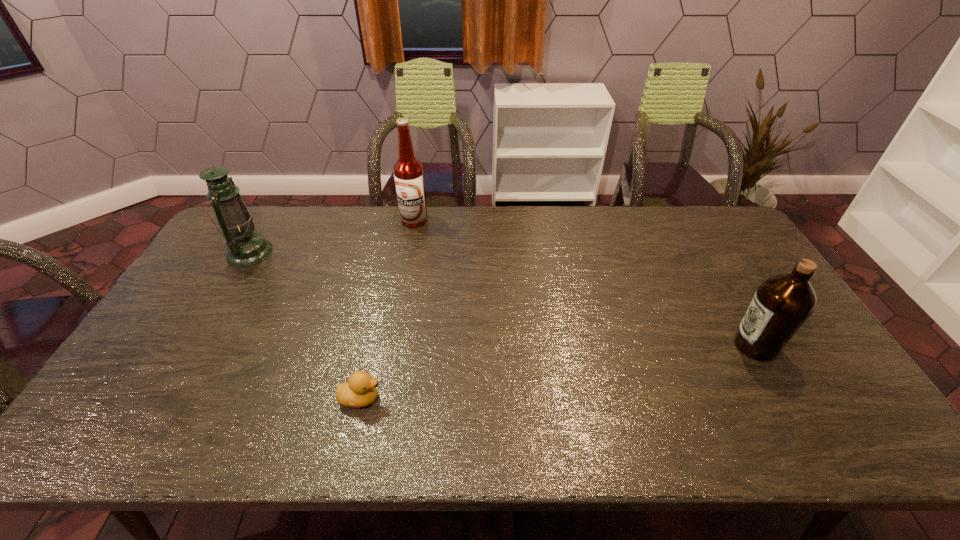
Find the location of a particular element. The height and width of the screenshot is (540, 960). vacant area located on the label of the rightmost object is located at coordinates (588, 345).

Where is `blank area located on the label of the rightmost object`? This screenshot has width=960, height=540. blank area located on the label of the rightmost object is located at coordinates (677, 345).

This screenshot has width=960, height=540. Find the location of `vacant space located facing forward on the nearest object`. vacant space located facing forward on the nearest object is located at coordinates (486, 398).

In order to click on alcohol located at the far edge in this screenshot , I will do `click(408, 171)`.

You are a GUI agent. You are given a task and a screenshot of the screen. Output one action in this format:
    pyautogui.click(x=<x>, y=<y>)
    Task: Click on the oil lamp at the far edge
    The image size is (960, 540).
    Given the screenshot: What is the action you would take?
    pyautogui.click(x=245, y=248)

Image resolution: width=960 pixels, height=540 pixels. What are the coordinates of `object at the left edge` in the screenshot? It's located at (245, 248).

Locate an element on the screen. The width and height of the screenshot is (960, 540). object positioned at the right edge is located at coordinates (782, 303).

Where is `object at the far left corner`? object at the far left corner is located at coordinates (245, 248).

This screenshot has height=540, width=960. I want to click on vacant area at the far edge of the desktop, so click(x=631, y=227).

In order to click on vacant space at the near edge of the desktop in this screenshot , I will do `click(172, 421)`.